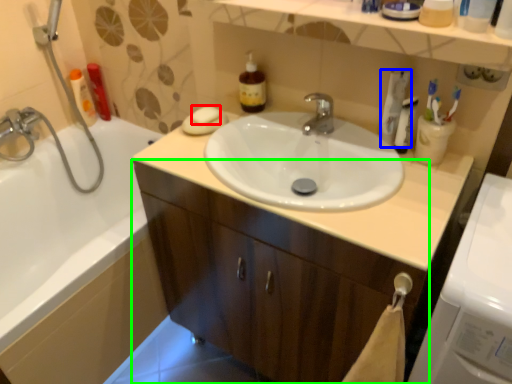
Question: Estimate the real-world distances between objects in this image. Which object is farther from soap (highlighted by a red box), toothpaste (highlighted by a blue box) or bathroom cabinet (highlighted by a green box)?

Choices:
 (A) toothpaste
 (B) bathroom cabinet

Answer: (B)